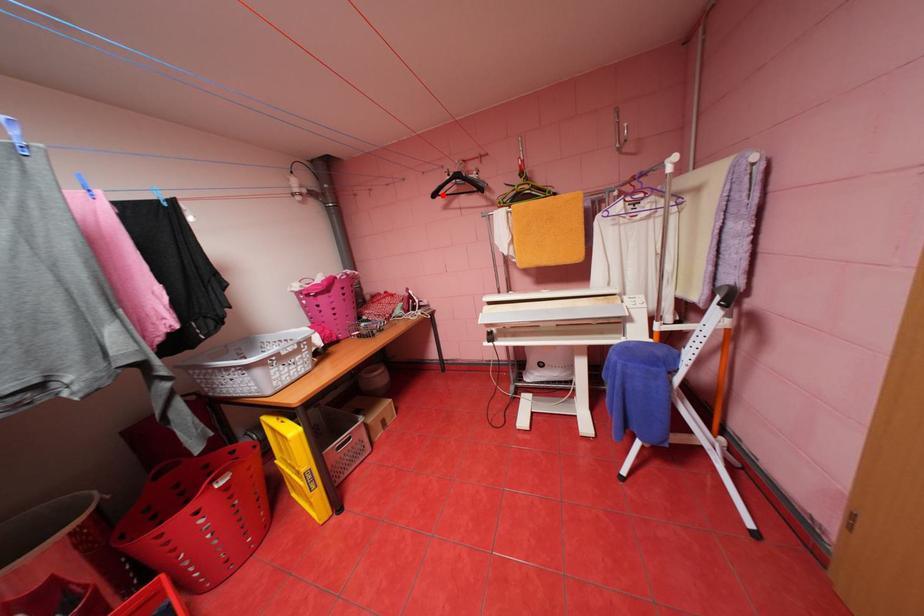
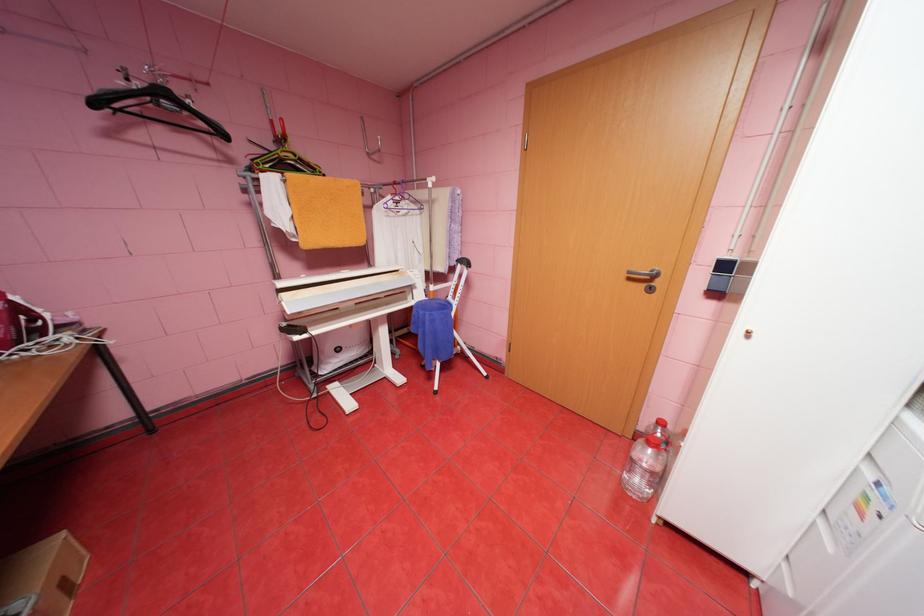
Question: I am providing you with two images of the same scene from different viewpoints. Given a red point in image1, look at the same physical point in image2. Is it:

Choices:
 (A) Closer to the viewpoint
 (B) Farther from the viewpoint

Answer: (B)